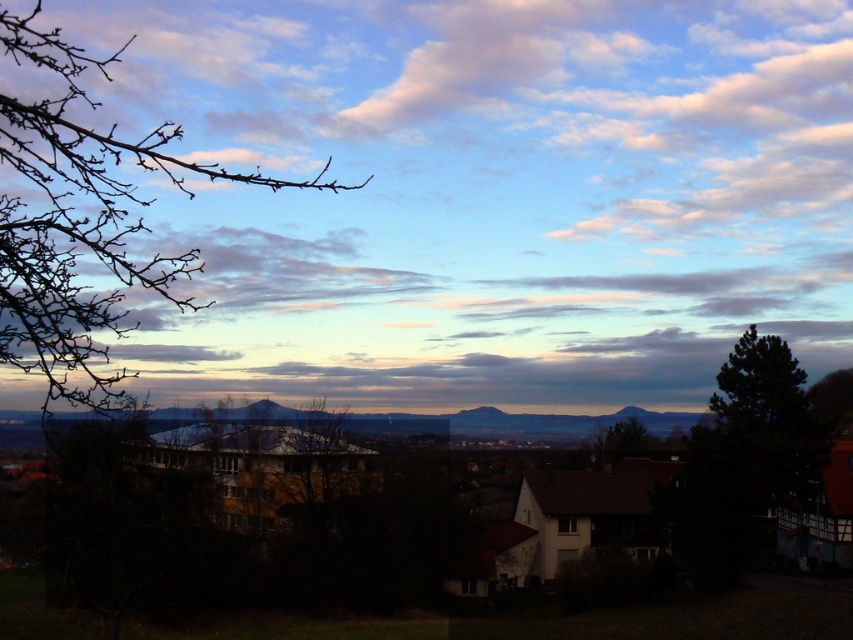
You are standing in the landscape scene and want to look at the cloudy sky at upper center. What direction should you face to see it?

The cloudy sky at upper center is located at point (489, 195), so you should face towards the upper center direction to see it.

You are an architect designing a new garden and want to incorporate both the brown bare branches at left and the dark green coniferous tree at right. Based on the image, which of these two objects is taller?

The brown bare branches at left is taller than the dark green coniferous tree at right according to the description.